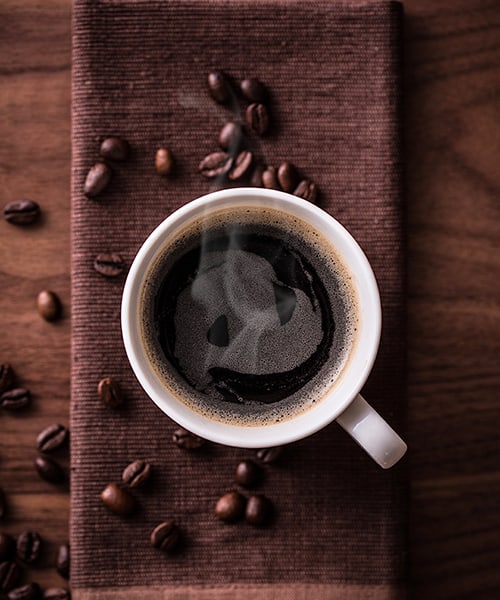
I want to click on dark brown wood table, so click(426, 364).